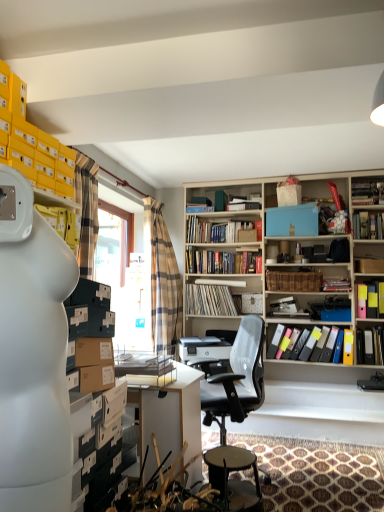
Question: From a real-world perspective, is multicolored file folders at upper right, which is counted as the seventh book, starting from the top, positioned above or below hardcover books at center, the 4th book when ordered from top to bottom?

Choices:
 (A) below
 (B) above

Answer: (A)

Question: From the image's perspective, is multicolored file folders at upper right, which ranks as the fourth book in bottom-to-top order, located above or below hardcover books at center, placed as the seventh book when sorted from bottom to top?

Choices:
 (A) above
 (B) below

Answer: (B)

Question: Estimate the real-world distances between objects in this image. Which object is farther from the matte black book at upper center, the fifth book in the bottom-to-top sequence?

Choices:
 (A) blue cardboard box at upper center, which is the 9th book in bottom-to-top order
 (B) plaid fabric curtain at center
 (C) white vinyl records at center, positioned as the eighth book in top-to-bottom order
 (D) hardcover books at center, placed as the seventh book when sorted from bottom to top
 (E) black leather bar stool at center

Answer: (E)

Question: Estimate the real-world distances between objects in this image. Which object is closer to the blue matte box at upper center?

Choices:
 (A) blue cardboard box at upper center, which is counted as the 2th book, starting from the top
 (B) hardcover books at center, placed as the seventh book when sorted from bottom to top
 (C) multicolored plastic folders at center right, marked as the first book in a bottom-to-top arrangement
 (D) black mesh office chair at center
 (E) hardcover book at upper right, placed as the third book when sorted from top to bottom

Answer: (B)